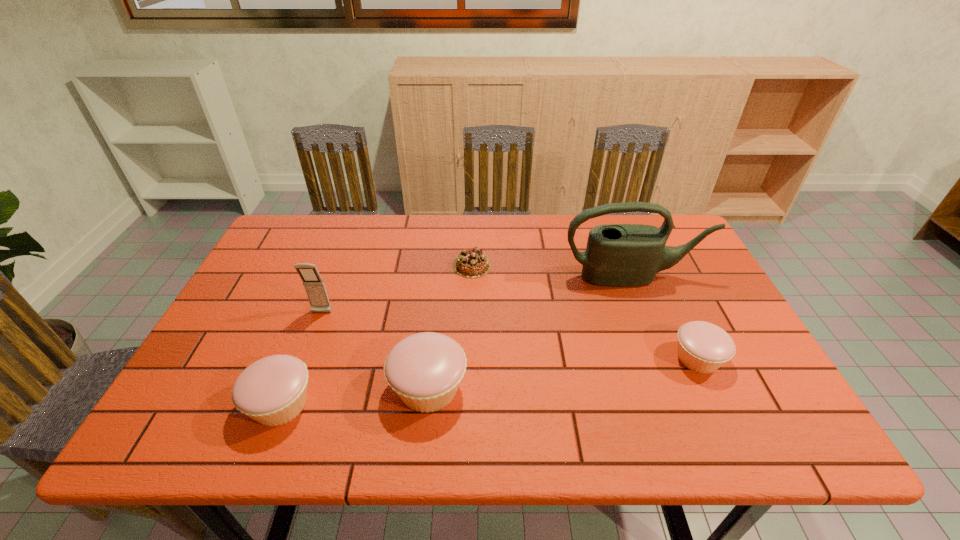
The image size is (960, 540). Find the location of `cupcake that is the closest to the chocolate cake`. cupcake that is the closest to the chocolate cake is located at coordinates (425, 370).

Find the location of a particular element. free space that satisfies the following two spatial constraints: 1. on the spout of the tallest object; 2. on the right side of the shortest cupcake is located at coordinates pyautogui.click(x=664, y=358).

Where is `free spot that satisfies the following two spatial constraints: 1. on the front-facing side of the cellular telephone; 2. on the right side of the shortest cupcake`? free spot that satisfies the following two spatial constraints: 1. on the front-facing side of the cellular telephone; 2. on the right side of the shortest cupcake is located at coordinates (304, 358).

Locate an element on the screen. The image size is (960, 540). vacant space that satisfies the following two spatial constraints: 1. on the back side of the leftmost cupcake; 2. on the left side of the second cupcake from left to right is located at coordinates (287, 388).

I want to click on vacant area in the image that satisfies the following two spatial constraints: 1. on the front-facing side of the fourth nearest object; 2. on the left side of the second cupcake from right to left, so click(293, 388).

What are the coordinates of `vacant region that satisfies the following two spatial constraints: 1. on the spout of the tallest object; 2. on the right side of the shortest cupcake` in the screenshot? It's located at (664, 358).